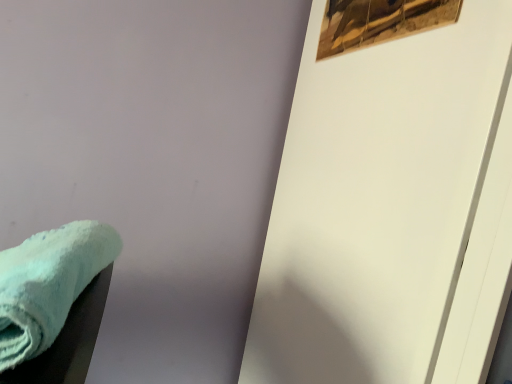
Question: From a real-world perspective, is wooden frame at upper right above or below soft teal towel at lower left?

Choices:
 (A) below
 (B) above

Answer: (B)

Question: Looking at their shapes, would you say wooden frame at upper right is wider or thinner than soft teal towel at lower left?

Choices:
 (A) wide
 (B) thin

Answer: (B)

Question: Considering the positions of wooden frame at upper right and soft teal towel at lower left in the image, is wooden frame at upper right taller or shorter than soft teal towel at lower left?

Choices:
 (A) tall
 (B) short

Answer: (B)

Question: Is soft teal towel at lower left inside the boundaries of wooden frame at upper right, or outside?

Choices:
 (A) outside
 (B) inside

Answer: (A)

Question: From a real-world perspective, is soft teal towel at lower left physically located above or below wooden frame at upper right?

Choices:
 (A) above
 (B) below

Answer: (B)

Question: Considering the positions of soft teal towel at lower left and wooden frame at upper right in the image, is soft teal towel at lower left taller or shorter than wooden frame at upper right?

Choices:
 (A) tall
 (B) short

Answer: (A)

Question: From the image's perspective, is soft teal towel at lower left above or below wooden frame at upper right?

Choices:
 (A) above
 (B) below

Answer: (B)